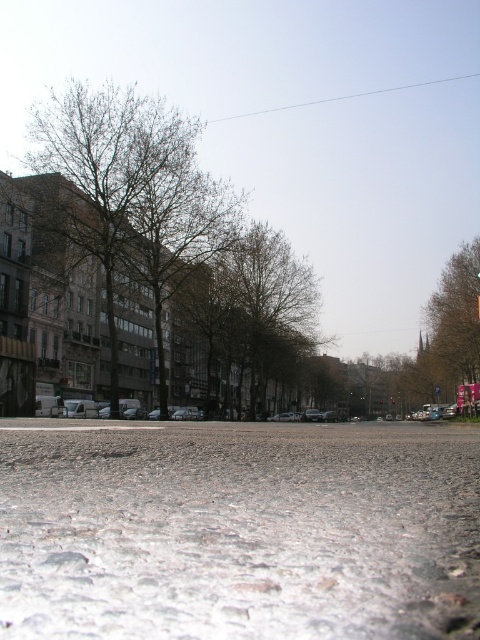
From the picture: Does white granular snow at center come in front of brown leafy tree at right?

That is True.

Is white granular snow at center behind brown leafy tree at right?

No, white granular snow at center is in front of brown leafy tree at right.

Image resolution: width=480 pixels, height=640 pixels. What do you see at coordinates (239, 531) in the screenshot?
I see `white granular snow at center` at bounding box center [239, 531].

You are a GUI agent. You are given a task and a screenshot of the screen. Output one action in this format:
    pyautogui.click(x=<x>, y=<y>)
    Task: Click on the white granular snow at center
    This screenshot has width=480, height=640.
    Given the screenshot: What is the action you would take?
    pyautogui.click(x=239, y=531)

Based on the photo, does brown leafless tree at left have a smaller size compared to brown leafy tree at right?

Incorrect, brown leafless tree at left is not smaller in size than brown leafy tree at right.

Can you confirm if brown leafless tree at left is thinner than brown leafy tree at right?

No, brown leafless tree at left is not thinner than brown leafy tree at right.

You are a GUI agent. You are given a task and a screenshot of the screen. Output one action in this format:
    pyautogui.click(x=<x>, y=<y>)
    Task: Click on the brown leafless tree at left
    The image size is (480, 640).
    Given the screenshot: What is the action you would take?
    pyautogui.click(x=152, y=256)

You are a GUI agent. You are given a task and a screenshot of the screen. Output one action in this format:
    pyautogui.click(x=<x>, y=<y>)
    Task: Click on the brown leafless tree at left
    
    Given the screenshot: What is the action you would take?
    [x=152, y=256]

Who is higher up, white granular snow at center or brown leafless tree at left?

Positioned higher is brown leafless tree at left.

Is point (324, 634) positioned after point (39, 209)?

No, (324, 634) is in front of (39, 209).

The width and height of the screenshot is (480, 640). Find the location of `white granular snow at center`. white granular snow at center is located at coordinates (239, 531).